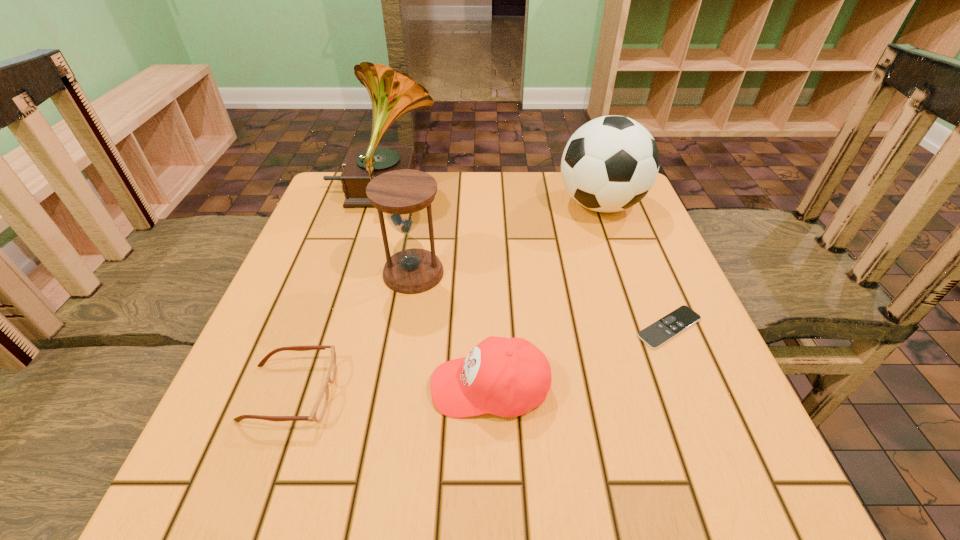
Where is `the tallest object`? Image resolution: width=960 pixels, height=540 pixels. the tallest object is located at coordinates (392, 93).

The image size is (960, 540). In order to click on soccer ball in this screenshot , I will do `click(609, 164)`.

Locate an element on the screen. hourglass is located at coordinates (401, 194).

The width and height of the screenshot is (960, 540). In order to click on the third shortest object in this screenshot , I will do `click(507, 377)`.

I want to click on spectacles, so click(x=318, y=411).

At what (x,y) coordinates should I click in order to perform the action: click on the fourth farthest object. Please return your answer as a coordinate pair (x, y). The image size is (960, 540). Looking at the image, I should click on (656, 334).

What are the coordinates of `the shortest object` in the screenshot? It's located at click(x=656, y=334).

Locate an element on the screen. The image size is (960, 540). vacant area situated 0.190m from the horn of the phonograph record is located at coordinates (511, 191).

You are a GUI agent. You are given a task and a screenshot of the screen. Output one action in this format:
    pyautogui.click(x=<x>, y=<y>)
    Task: Click on the vacant space located on the front of the soccer ball
    
    Given the screenshot: What is the action you would take?
    pyautogui.click(x=620, y=262)

Locate an element on the screen. The width and height of the screenshot is (960, 540). vacant space located on the back of the hourglass is located at coordinates (420, 227).